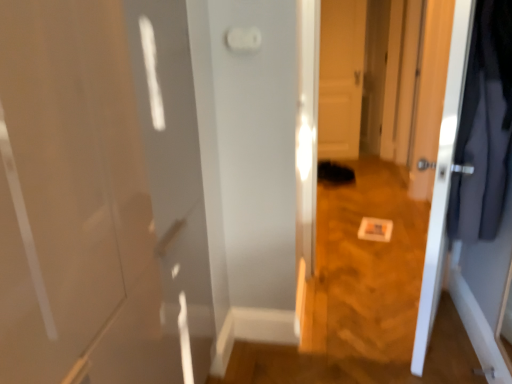
Question: From the image's perspective, would you say white plastic light switch at upper center is shown under dark gray fabric coat at right?

Choices:
 (A) no
 (B) yes

Answer: (A)

Question: Is white plastic light switch at upper center surrounding dark gray fabric coat at right?

Choices:
 (A) yes
 (B) no

Answer: (B)

Question: Is white plastic light switch at upper center further to the viewer compared to dark gray fabric coat at right?

Choices:
 (A) no
 (B) yes

Answer: (B)

Question: Considering the relative positions of white plastic light switch at upper center and dark gray fabric coat at right in the image provided, is white plastic light switch at upper center in front of dark gray fabric coat at right?

Choices:
 (A) no
 (B) yes

Answer: (A)

Question: Can you confirm if white plastic light switch at upper center is smaller than dark gray fabric coat at right?

Choices:
 (A) no
 (B) yes

Answer: (B)

Question: Is point (492, 23) positioned closer to the camera than point (437, 190)?

Choices:
 (A) farther
 (B) closer

Answer: (B)

Question: Is dark gray fabric coat at right spatially inside white glossy door at right, which is the second door in back-to-front order, or outside of it?

Choices:
 (A) inside
 (B) outside

Answer: (B)

Question: Based on their positions, is dark gray fabric coat at right located to the left or right of white glossy door at right, which appears as the 1th door when viewed from the front?

Choices:
 (A) left
 (B) right

Answer: (B)

Question: Considering the positions of dark gray fabric coat at right and white glossy door at right, which is the second door in back-to-front order, in the image, is dark gray fabric coat at right bigger or smaller than white glossy door at right, which is the second door in back-to-front order,?

Choices:
 (A) big
 (B) small

Answer: (B)

Question: Is point (324, 29) positioned closer to the camera than point (248, 34)?

Choices:
 (A) closer
 (B) farther

Answer: (B)

Question: Is white glossy door at center, acting as the first door starting from the back, in front of or behind white plastic light switch at upper center in the image?

Choices:
 (A) front
 (B) behind

Answer: (B)

Question: From the image's perspective, is white glossy door at center, which appears as the 2th door when viewed from the front, located above or below white plastic light switch at upper center?

Choices:
 (A) below
 (B) above

Answer: (B)

Question: Considering the positions of white glossy door at center, which appears as the 2th door when viewed from the front, and white plastic light switch at upper center in the image, is white glossy door at center, which appears as the 2th door when viewed from the front, bigger or smaller than white plastic light switch at upper center?

Choices:
 (A) small
 (B) big

Answer: (B)

Question: From a real-world perspective, relative to white glossy door at center, which appears as the 2th door when viewed from the front, is white glossy door at right, which appears as the 1th door when viewed from the front, vertically above or below?

Choices:
 (A) above
 (B) below

Answer: (B)

Question: Would you say white glossy door at right, which is the second door in back-to-front order, is to the left or to the right of white glossy door at center, acting as the first door starting from the back, in the picture?

Choices:
 (A) right
 (B) left

Answer: (B)